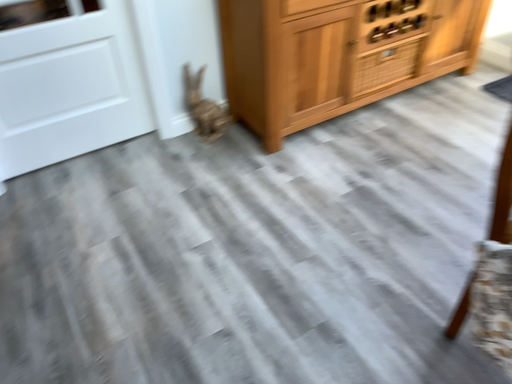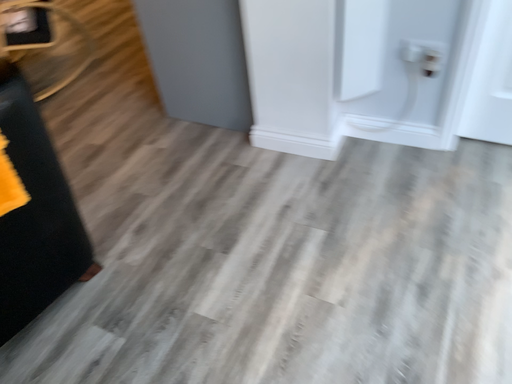
Question: How did the camera likely rotate when shooting the video?

Choices:
 (A) rotated left
 (B) rotated right

Answer: (A)